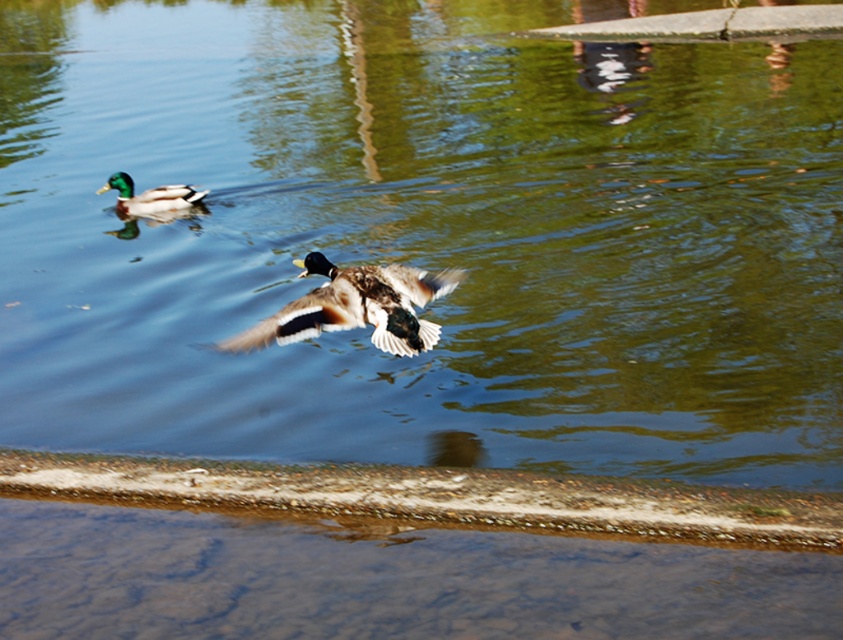
Question: Can you confirm if brown speckled feathers at center is positioned above green glossy duck at upper left?

Choices:
 (A) yes
 (B) no

Answer: (B)

Question: Among these points, which one is farthest from the camera?

Choices:
 (A) (380, 273)
 (B) (154, 193)

Answer: (B)

Question: Which of the following is the farthest from the observer?

Choices:
 (A) green glossy duck at upper left
 (B) brown speckled feathers at center

Answer: (A)

Question: Is the position of brown speckled feathers at center more distant than that of green glossy duck at upper left?

Choices:
 (A) yes
 (B) no

Answer: (B)

Question: Is brown speckled feathers at center below green glossy duck at upper left?

Choices:
 (A) no
 (B) yes

Answer: (B)